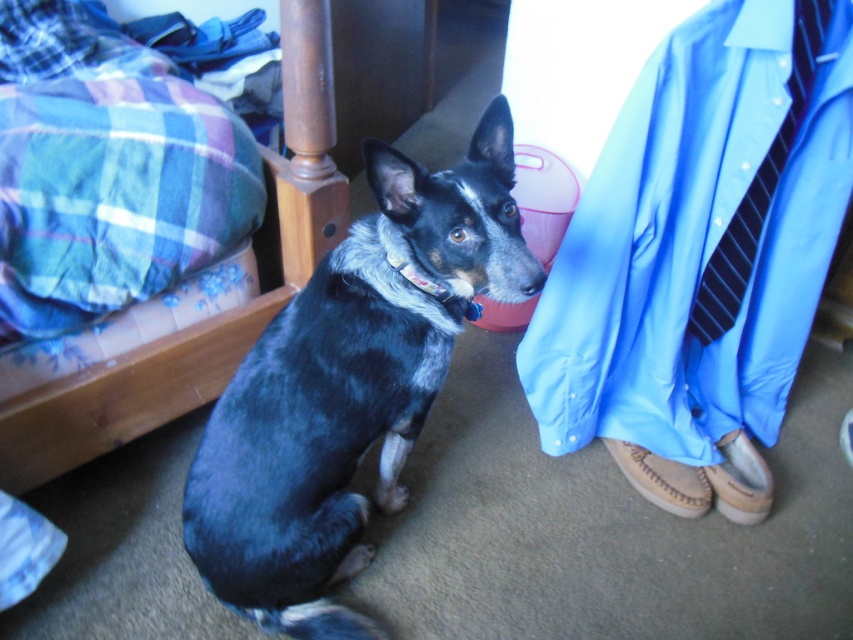
Who is shorter, brown suede sandal at lower right or brown leather sandal at lower right?

With less height is brown suede sandal at lower right.

Does brown suede sandal at lower right lie in front of brown leather sandal at lower right?

No, brown suede sandal at lower right is behind brown leather sandal at lower right.

Who is more distant from viewer, (x=706, y=500) or (x=732, y=433)?

The point (x=732, y=433) is more distant.

Locate an element on the screen. The height and width of the screenshot is (640, 853). brown suede sandal at lower right is located at coordinates (662, 480).

Is point (498, 276) less distant than point (57, 454)?

That is True.

Which is in front, point (407, 170) or point (80, 397)?

Point (407, 170) is in front.

This screenshot has height=640, width=853. In order to click on blue-black fur dog at center in this screenshot , I will do `click(349, 385)`.

Can you confirm if black striped tie at right is positioned to the right of brown leather sandal at lower right?

No, black striped tie at right is not to the right of brown leather sandal at lower right.

Describe the element at coordinates (758, 188) in the screenshot. This screenshot has width=853, height=640. I see `black striped tie at right` at that location.

Is point (764, 173) positioned in front of point (744, 476)?

That is True.

Find the location of a particular element. black striped tie at right is located at coordinates (758, 188).